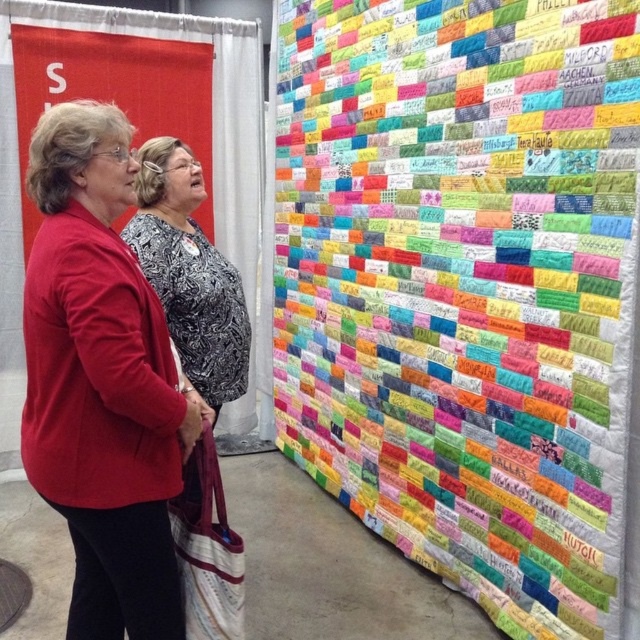
Between colorful fabric quilt at upper right and patterned fabric blouse at center, which one is positioned lower?

Positioned lower is patterned fabric blouse at center.

Who is higher up, colorful fabric quilt at upper right or patterned fabric blouse at center?

colorful fabric quilt at upper right is higher up.

Which is behind, point (572, 122) or point (198, 332)?

Positioned behind is point (198, 332).

In order to click on colorful fabric quilt at upper right in this screenshot , I will do `click(465, 288)`.

Looking at this image, which is more to the right, matte red cardigan at center or patterned fabric blouse at center?

Positioned to the right is patterned fabric blouse at center.

Is matte red cardigan at center positioned in front of patterned fabric blouse at center?

Yes, matte red cardigan at center is in front of patterned fabric blouse at center.

Who is more distant from viewer, (72,124) or (220,291)?

The point (220,291) is behind.

Image resolution: width=640 pixels, height=640 pixels. In order to click on matte red cardigan at center in this screenshot , I will do `click(100, 381)`.

Does colorful fabric quilt at upper right have a greater height compared to matte red cardigan at center?

Yes.

Is colorful fabric quilt at upper right closer to camera compared to matte red cardigan at center?

No.

Find the location of a particular element. The image size is (640, 640). colorful fabric quilt at upper right is located at coordinates (465, 288).